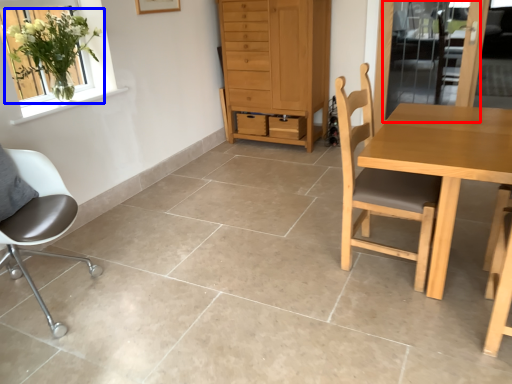
Question: Which object is closer to the camera taking this photo, screen door (highlighted by a red box) or houseplant (highlighted by a blue box)?

Choices:
 (A) screen door
 (B) houseplant

Answer: (B)